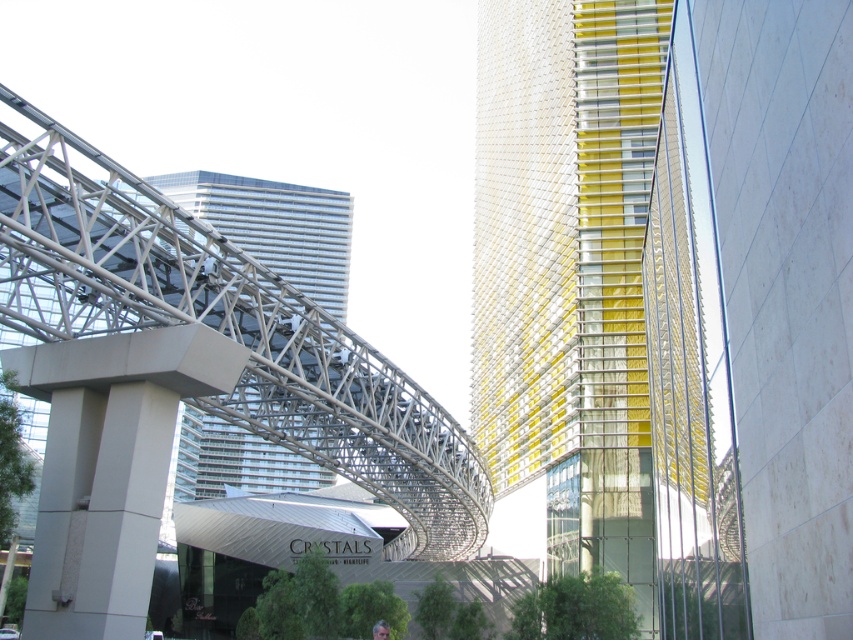
Is the position of gray concrete pillar at lower left more distant than that of glassy reflective skyscraper at center?

No.

Is gray concrete pillar at lower left above glassy reflective skyscraper at center?

Actually, gray concrete pillar at lower left is below glassy reflective skyscraper at center.

Is point (108, 381) more distant than point (316, 212)?

No, it is not.

Identify the location of gray concrete pillar at lower left. pyautogui.click(x=108, y=467).

Can you confirm if metallic gray pedestrian bridge at center-left is positioned above glassy reflective skyscraper at center?

No.

Who is more forward, (250, 420) or (281, 227)?

Positioned in front is point (250, 420).

Image resolution: width=853 pixels, height=640 pixels. I want to click on metallic gray pedestrian bridge at center-left, so click(x=225, y=326).

Does yellow glass building at center have a smaller size compared to glassy reflective skyscraper at center?

Yes.

Is yellow glass building at center wider than glassy reflective skyscraper at center?

Incorrect, yellow glass building at center's width does not surpass glassy reflective skyscraper at center's.

Who is more forward, (634, 17) or (332, 244)?

Point (634, 17)

At what (x,y) coordinates should I click in order to perform the action: click on yellow glass building at center. Please return your answer as a coordinate pair (x, y). The height and width of the screenshot is (640, 853). Looking at the image, I should click on (579, 292).